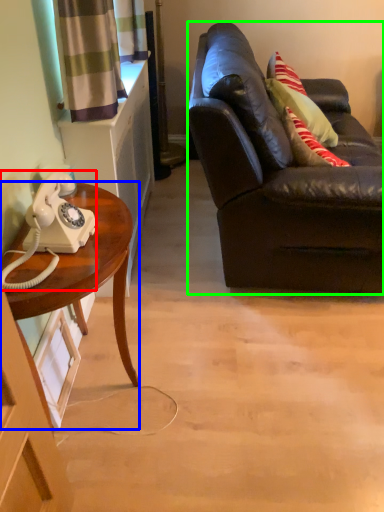
Question: Estimate the real-world distances between objects in this image. Which object is closer to corded phone (highlighted by a red box), desk (highlighted by a blue box) or studio couch (highlighted by a green box)?

Choices:
 (A) desk
 (B) studio couch

Answer: (A)